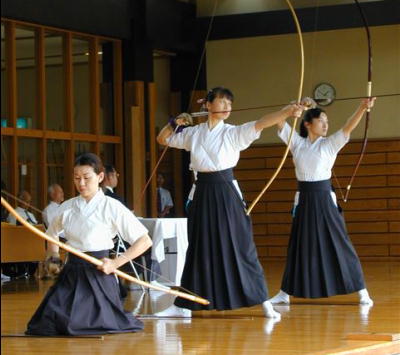
Identify the location of clock. (326, 89).